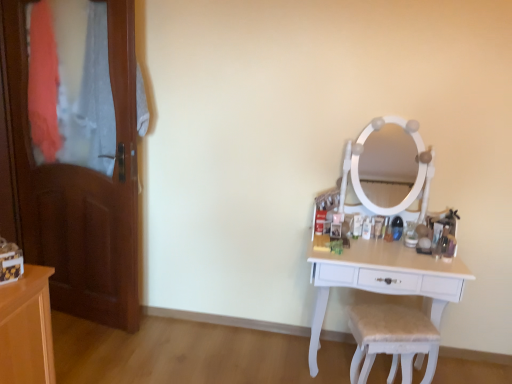
What do you see at coordinates (81, 188) in the screenshot? The image size is (512, 384). I see `wooden door at left` at bounding box center [81, 188].

What do you see at coordinates (383, 279) in the screenshot? I see `white wood table at right` at bounding box center [383, 279].

This screenshot has width=512, height=384. I want to click on wooden door at left, so click(x=81, y=188).

Are white wood table at right and wooden door at left far apart?

Yes.

Is white wood table at right to the left or to the right of wooden door at left in the image?

white wood table at right is positioned on wooden door at left's right side.

There is a white wood table at right. What are the coordinates of `door above it (from a real-world perspective)` in the screenshot? It's located at (81, 188).

Which point is more distant from viewer, (401, 276) or (133, 34)?

The point (133, 34) is farther.

Is white fabric-covered chair at lower right facing towards wooden door at left?

No, white fabric-covered chair at lower right is not aimed at wooden door at left.

From the picture: In terms of size, does white fabric-covered chair at lower right appear bigger or smaller than wooden door at left?

white fabric-covered chair at lower right is smaller than wooden door at left.

Image resolution: width=512 pixels, height=384 pixels. I want to click on door above the white fabric-covered chair at lower right (from a real-world perspective), so click(81, 188).

Is wooden door at left next to white fabric-covered chair at lower right and touching it?

No, wooden door at left is not with white fabric-covered chair at lower right.

Is wooden door at left shorter than white fabric-covered chair at lower right?

Incorrect, the height of wooden door at left does not fall short of that of white fabric-covered chair at lower right.

Identify the location of chair in front of the wooden door at left. This screenshot has width=512, height=384. (391, 339).

Which of these two, wooden door at left or white wood table at right, stands shorter?

With less height is white wood table at right.

Is wooden door at left not near white wood table at right?

Yes.

Can you tell me how much wooden door at left and white wood table at right differ in facing direction?

The angular difference between wooden door at left and white wood table at right is 9.96 degrees.

Is wooden door at left wider than white wood table at right?

Incorrect, the width of wooden door at left does not surpass that of white wood table at right.

Would you say white wood table at right contains white fabric-covered chair at lower right?

Yes, white fabric-covered chair at lower right can be found within white wood table at right.

At what (x,y) coordinates should I click in order to perform the action: click on chair on the right of white wood table at right. Please return your answer as a coordinate pair (x, y). This screenshot has width=512, height=384. Looking at the image, I should click on (391, 339).

Is white wood table at right bigger or smaller than white fabric-covered chair at lower right?

Considering their sizes, white wood table at right takes up more space than white fabric-covered chair at lower right.

Considering the sizes of white wood table at right and white fabric-covered chair at lower right in the image, is white wood table at right taller or shorter than white fabric-covered chair at lower right?

Considering their sizes, white wood table at right has more height than white fabric-covered chair at lower right.

Considering the relative positions of white fabric-covered chair at lower right and white wood table at right in the image provided, is white fabric-covered chair at lower right to the right of white wood table at right from the viewer's perspective?

Indeed, white fabric-covered chair at lower right is positioned on the right side of white wood table at right.

Where is `chair in front of the white wood table at right`? This screenshot has width=512, height=384. chair in front of the white wood table at right is located at coordinates (391, 339).

At what (x,y) coordinates should I click in order to perform the action: click on door behind the white wood table at right. Please return your answer as a coordinate pair (x, y). Looking at the image, I should click on (81, 188).

At what (x,y) coordinates should I click in order to perform the action: click on door that is above the white fabric-covered chair at lower right (from a real-world perspective). Please return your answer as a coordinate pair (x, y). Looking at the image, I should click on (81, 188).

Considering their positions, is wooden door at left positioned further to white fabric-covered chair at lower right than white wood table at right?

wooden door at left.

Looking at the image, which one is located further to white wood table at right, wooden door at left or white fabric-covered chair at lower right?

The object further to white wood table at right is wooden door at left.

Looking at the image, which one is located closer to wooden door at left, white fabric-covered chair at lower right or white wood table at right?

white wood table at right is positioned closer to the anchor wooden door at left.

Based on the photo, looking at the image, which one is located closer to wooden door at left, white wood table at right or white fabric-covered chair at lower right?

Based on the image, white wood table at right appears to be nearer to wooden door at left.

Estimate the real-world distances between objects in this image. Which object is closer to white wood table at right, white fabric-covered chair at lower right or wooden door at left?

Among the two, white fabric-covered chair at lower right is located nearer to white wood table at right.

Estimate the real-world distances between objects in this image. Which object is closer to white fabric-covered chair at lower right, white wood table at right or wooden door at left?

white wood table at right is closer to white fabric-covered chair at lower right.

Where is `table situated between wooden door at left and white fabric-covered chair at lower right from left to right`? Image resolution: width=512 pixels, height=384 pixels. table situated between wooden door at left and white fabric-covered chair at lower right from left to right is located at coordinates (383, 279).